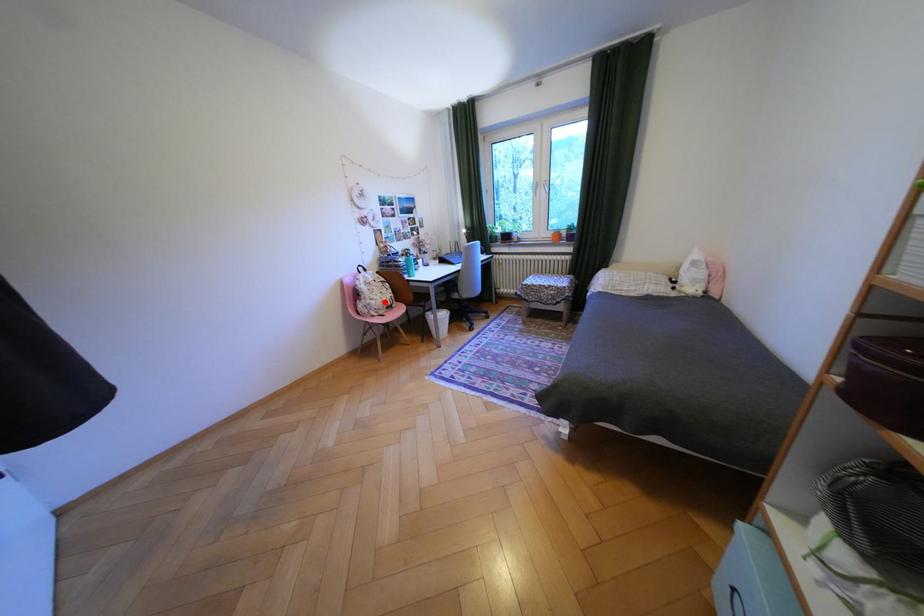
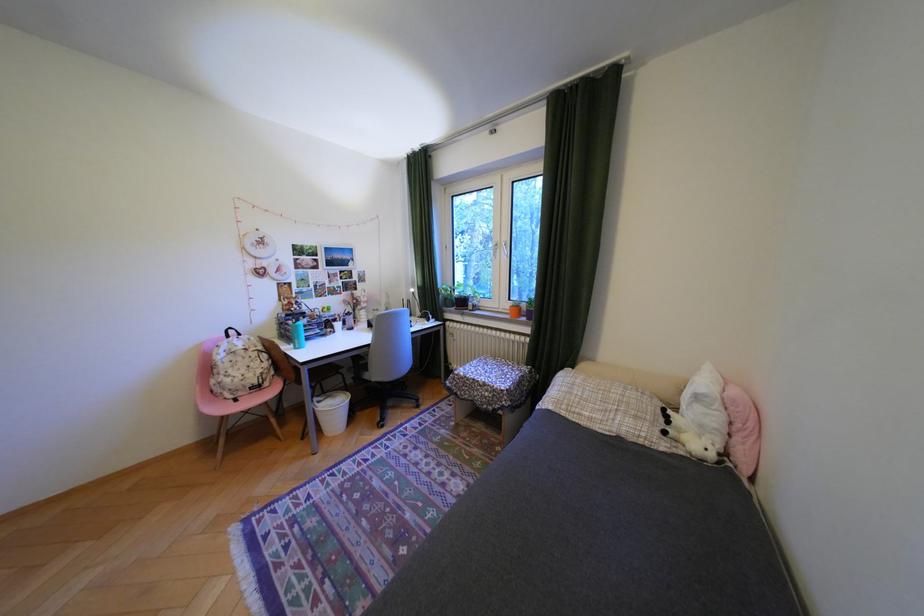
Find the pixel in the second image that matches the highlighted location in the first image.

(239, 379)